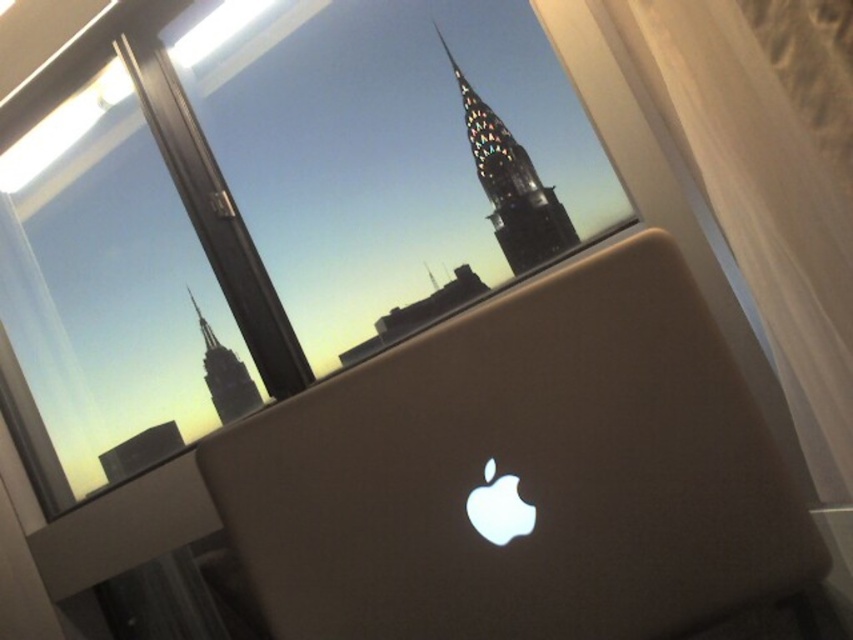
Between point (410, 365) and point (497, 172), which one is positioned behind?

Point (497, 172)

Can you confirm if satin gold laptop at center is positioned to the left of stained glass spire at upper center?

Correct, you'll find satin gold laptop at center to the left of stained glass spire at upper center.

Who is more distant from viewer, (364, 484) or (480, 108)?

The point (480, 108) is more distant.

The height and width of the screenshot is (640, 853). I want to click on satin gold laptop at center, so click(523, 474).

Does stained glass spire at upper center appear on the right side of dark gray glass skyscraper at center?

Indeed, stained glass spire at upper center is positioned on the right side of dark gray glass skyscraper at center.

Is stained glass spire at upper center above dark gray glass skyscraper at center?

Yes, stained glass spire at upper center is above dark gray glass skyscraper at center.

This screenshot has width=853, height=640. What are the coordinates of `stained glass spire at upper center` in the screenshot? It's located at (511, 184).

Is satin gold laptop at center wider than dark gray glass skyscraper at center?

Yes.

Measure the distance between satin gold laptop at center and camera.

25.16 inches

Find the location of a particular element. This screenshot has width=853, height=640. satin gold laptop at center is located at coordinates (523, 474).